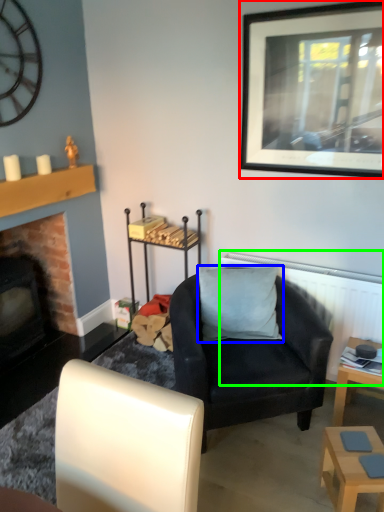
Question: Estimate the real-world distances between objects in this image. Which object is closer to picture frame (highlighted by a red box), pillow (highlighted by a blue box) or radiator (highlighted by a green box)?

Choices:
 (A) pillow
 (B) radiator

Answer: (B)